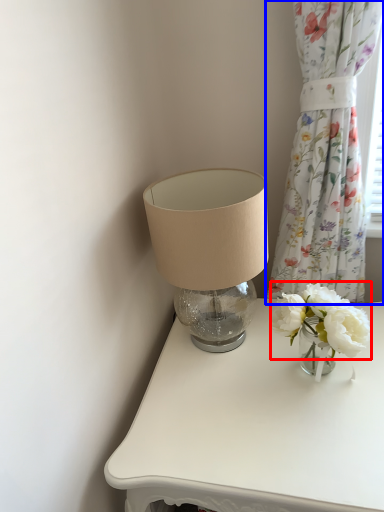
Question: Which object is closer to the camera taking this photo, flower (highlighted by a red box) or curtain (highlighted by a blue box)?

Choices:
 (A) flower
 (B) curtain

Answer: (B)